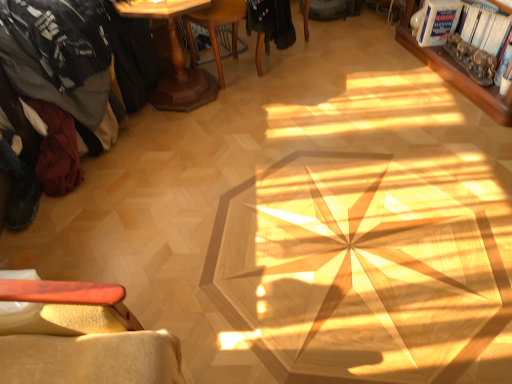
Image resolution: width=512 pixels, height=384 pixels. I want to click on vacant region in front of wooden at center, the second chair when ordered from right to left, so click(x=245, y=108).